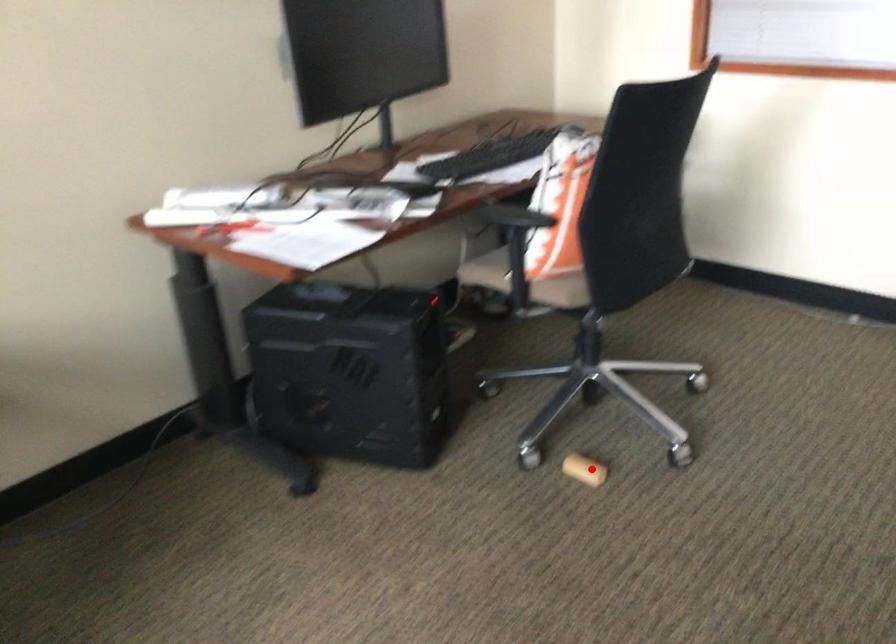
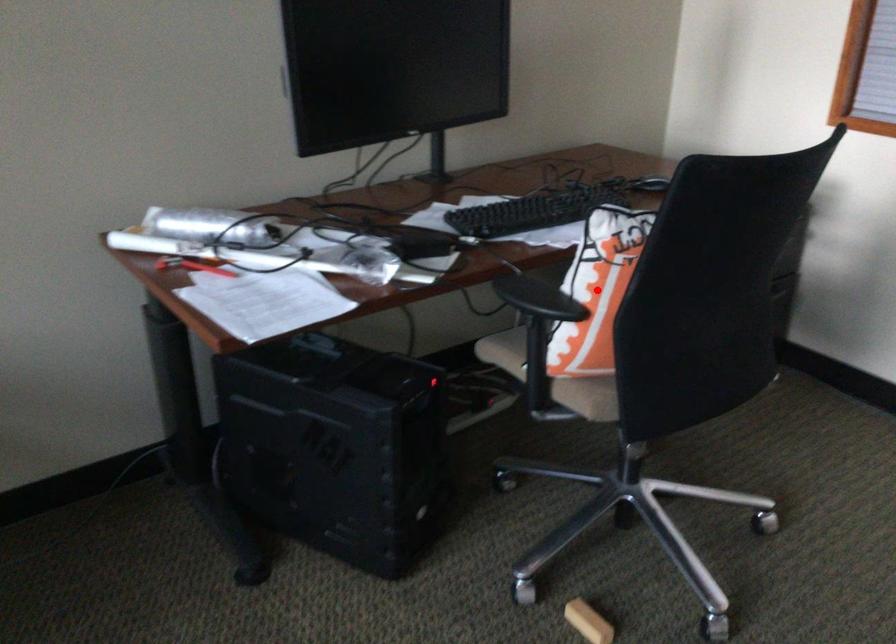
I am providing you with two images of the same scene from different viewpoints. A red point is marked on the first image and another point is marked on the second image. Do the highlighted points in image1 and image2 indicate the same real-world spot?

No